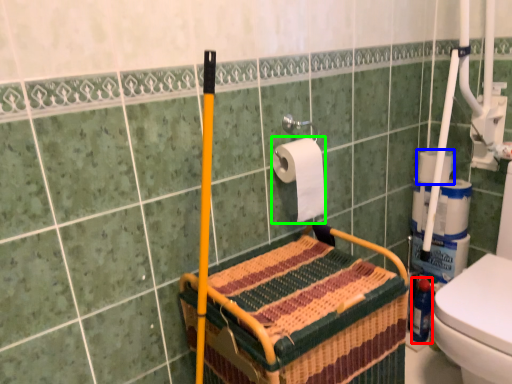
Question: Which object is the farthest from bottle (highlighted by a red box)? Choose among these: toilet paper (highlighted by a blue box) or toilet paper (highlighted by a green box).

Choices:
 (A) toilet paper
 (B) toilet paper

Answer: (B)